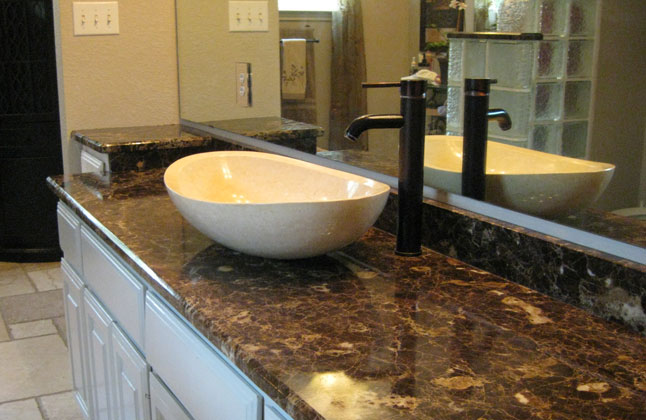
In order to click on faucet handle in this screenshot , I will do 379,83.